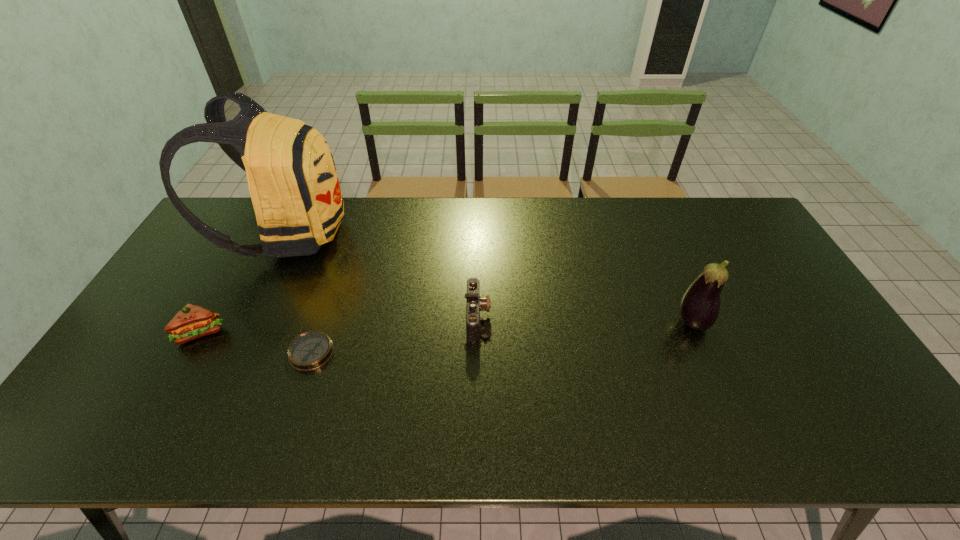
I want to click on backpack, so click(x=293, y=183).

Where is `the farthest object`? The image size is (960, 540). the farthest object is located at coordinates (293, 183).

Find the location of `eggplant`. eggplant is located at coordinates (700, 305).

You are a GUI agent. You are given a task and a screenshot of the screen. Output one action in this format:
    pyautogui.click(x=<x>, y=<y>)
    Task: Click on the second tallest object
    
    Given the screenshot: What is the action you would take?
    pyautogui.click(x=700, y=305)

The height and width of the screenshot is (540, 960). Find the location of `the third shortest object`. the third shortest object is located at coordinates (192, 321).

This screenshot has height=540, width=960. What are the coordinates of `camera` in the screenshot? It's located at (474, 303).

The height and width of the screenshot is (540, 960). In order to click on the second shortest object in this screenshot , I will do `click(474, 303)`.

This screenshot has width=960, height=540. Find the location of `the shortest object`. the shortest object is located at coordinates (311, 350).

Identify the location of blank space located on the front-facing side of the tallest object. This screenshot has width=960, height=540. (456, 233).

The height and width of the screenshot is (540, 960). In order to click on free space located on the front of the eggplant in this screenshot , I will do `click(717, 378)`.